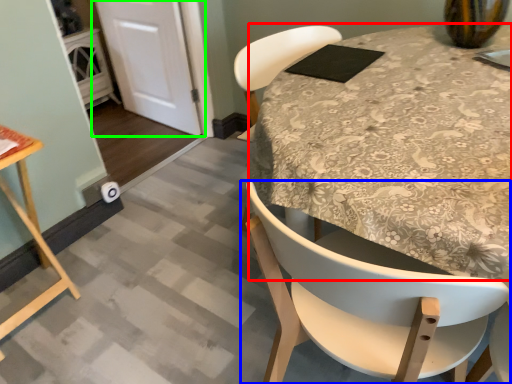
Question: Which object is positioned farthest from round table (highlighted by a red box)? Select from chair (highlighted by a blue box) and door (highlighted by a green box).

Choices:
 (A) chair
 (B) door

Answer: (B)